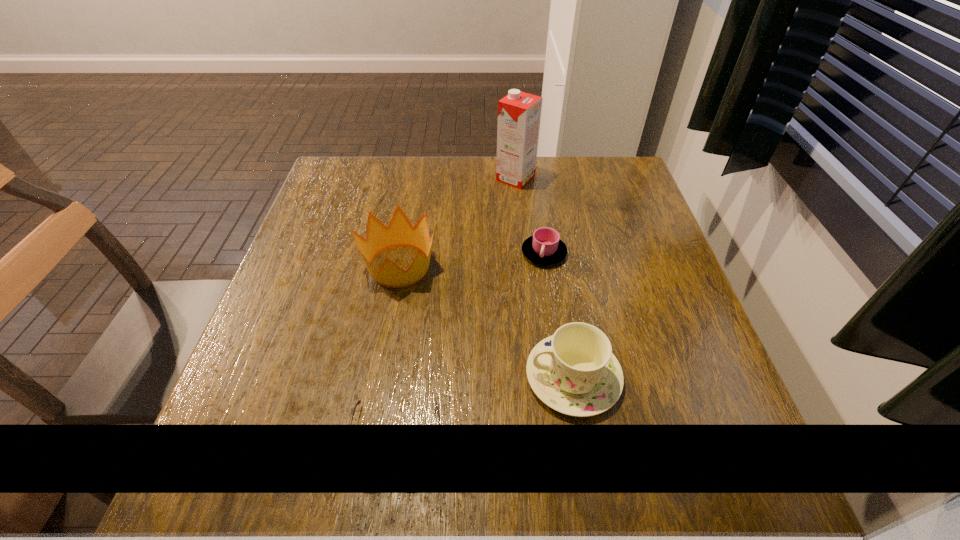
Locate an element on the screen. the farthest object is located at coordinates (519, 113).

In order to click on the tallest object in this screenshot , I will do point(519,113).

What are the coordinates of `crown` in the screenshot? It's located at (400, 232).

The image size is (960, 540). In order to click on chinaware in this screenshot , I will do `click(574, 371)`.

The image size is (960, 540). I want to click on sunglasses, so click(x=359, y=401).

The image size is (960, 540). I want to click on cup, so click(545, 247).

The width and height of the screenshot is (960, 540). Identify the location of blank area located on the left of the carton. (478, 178).

At what (x,y) coordinates should I click in order to perform the action: click on blank area located 0.050m on the back of the crown. Please return your answer as a coordinate pair (x, y). The image size is (960, 540). Looking at the image, I should click on (406, 227).

Locate an element on the screen. The image size is (960, 540). vacant space located on the handle side of the chinaware is located at coordinates (357, 377).

This screenshot has height=540, width=960. In order to click on blank space located 0.340m on the handle side of the chinaware in this screenshot , I will do `click(334, 377)`.